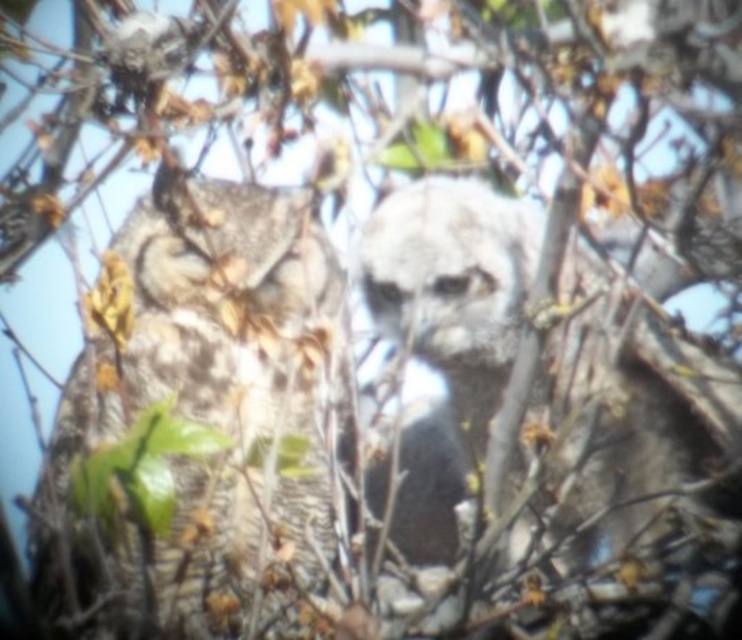
Question: Considering the relative positions of speckled feathered owl at center and fuzzy white owl at center in the image provided, where is speckled feathered owl at center located with respect to fuzzy white owl at center?

Choices:
 (A) above
 (B) below

Answer: (A)

Question: Can you confirm if speckled feathered owl at center is positioned below fuzzy white owl at center?

Choices:
 (A) no
 (B) yes

Answer: (A)

Question: Which point is closer to the camera?

Choices:
 (A) (188, 397)
 (B) (614, 534)

Answer: (B)

Question: Which point is closer to the camera?

Choices:
 (A) (263, 342)
 (B) (611, 492)

Answer: (B)

Question: Can you confirm if speckled feathered owl at center is thinner than fuzzy white owl at center?

Choices:
 (A) yes
 (B) no

Answer: (A)